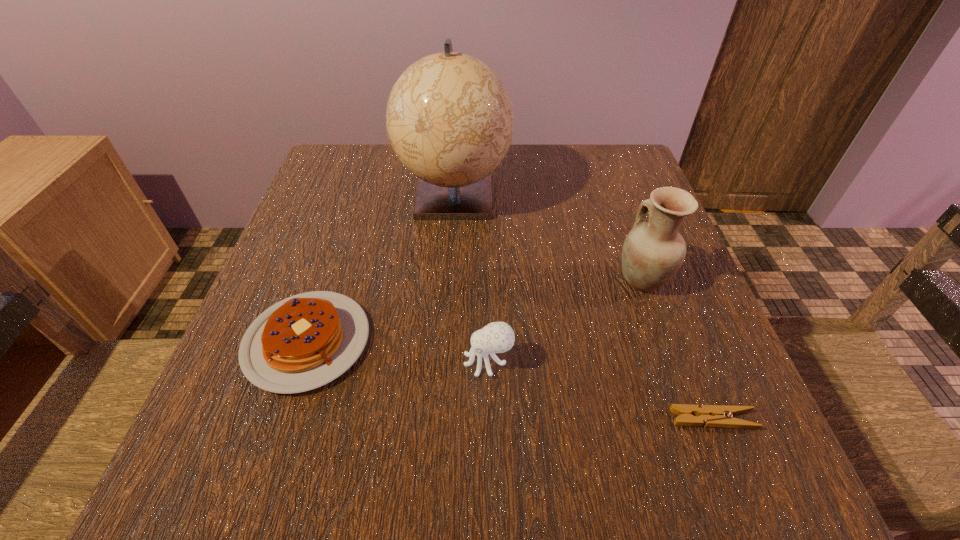
Locate an element on the screen. free space at the left edge of the desktop is located at coordinates (354, 243).

The height and width of the screenshot is (540, 960). What are the coordinates of `free space at the near left corner of the desktop` in the screenshot? It's located at (290, 487).

In order to click on blank space at the far right corner in this screenshot , I will do `click(592, 169)`.

Locate an element on the screen. free space at the near right corner is located at coordinates click(x=672, y=497).

Locate an element on the screen. The image size is (960, 540). vacant space that's between the fourth tallest object and the pottery is located at coordinates (475, 310).

The image size is (960, 540). Find the location of `free point between the nearest object and the octopus`. free point between the nearest object and the octopus is located at coordinates (601, 390).

This screenshot has height=540, width=960. Find the location of `free space between the fourth tallest object and the nearest object`. free space between the fourth tallest object and the nearest object is located at coordinates (510, 380).

Identify the location of vacant area that lies between the fourth tallest object and the pottery. Image resolution: width=960 pixels, height=540 pixels. (475, 310).

This screenshot has width=960, height=540. Find the location of `free space between the third tallest object and the farthest object`. free space between the third tallest object and the farthest object is located at coordinates (471, 278).

This screenshot has width=960, height=540. Identify the location of empty space between the pottery and the globe. (548, 237).